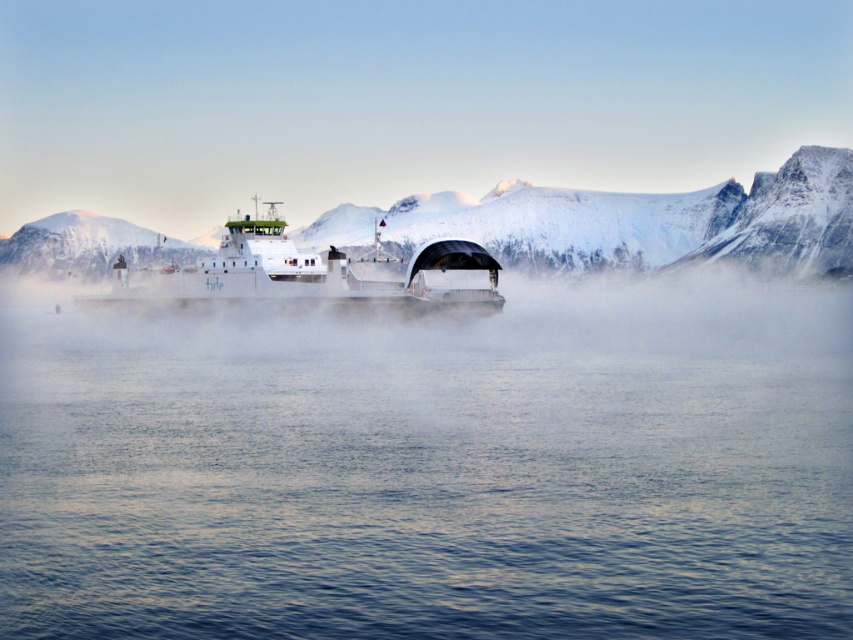
Who is higher up, clear water at center or white matte ferry at center?

white matte ferry at center is higher up.

Does point (166, 616) come in front of point (230, 253)?

That is True.

You are a GUI agent. You are given a task and a screenshot of the screen. Output one action in this format:
    pyautogui.click(x=<x>, y=<y>)
    Task: Click on the clear water at center
    
    Given the screenshot: What is the action you would take?
    pyautogui.click(x=433, y=468)

Consider the image. Is clear water at center in front of white snow-covered mountain at upper left?

Yes, it is.

Which is behind, point (398, 544) or point (45, 266)?

Point (45, 266)

Where is `clear water at center`? Image resolution: width=853 pixels, height=640 pixels. clear water at center is located at coordinates (433, 468).

Is white matte ferry at center wider than white snow-covered mountain at upper left?

Correct, the width of white matte ferry at center exceeds that of white snow-covered mountain at upper left.

Which is below, white matte ferry at center or white snow-covered mountain at upper left?

Positioned lower is white matte ferry at center.

Is point (279, 289) positioned before point (49, 276)?

Yes, it is.

Locate an element on the screen. The height and width of the screenshot is (640, 853). white matte ferry at center is located at coordinates (305, 276).